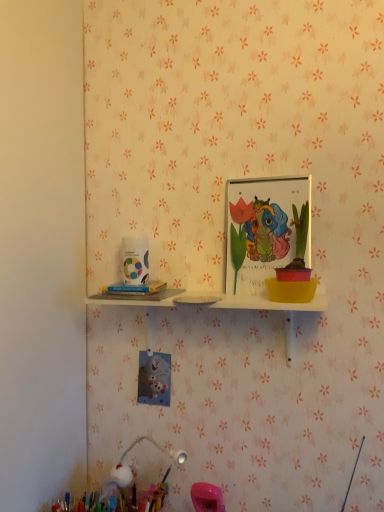
In order to face matte plastic picture frame at upper center, should I rotate leftwards or rightwards?

Rotate right and turn 10.202 degrees.

What do you see at coordinates (265, 230) in the screenshot? The image size is (384, 512). I see `matte plastic picture frame at upper center` at bounding box center [265, 230].

Identify the location of white glossy plate at upper center. Image resolution: width=384 pixels, height=512 pixels. (218, 308).

Describe the element at coordinates (135, 288) in the screenshot. I see `white paper at left` at that location.

Identify the location of pastel fluffy pom-pom at lower left. click(117, 499).

I want to click on matte plastic picture frame at upper center, so click(265, 230).

From the picture: From a real-world perspective, is white glossy plate at upper center physically below white paper at left?

Yes.

The image size is (384, 512). I want to click on shelf lying in front of the white paper at left, so click(218, 308).

Does point (292, 320) appear closer or farther from the camera than point (163, 283)?

Point (292, 320).

Would you say white glossy plate at upper center is to the left or to the right of white paper at left in the picture?

From the image, it's evident that white glossy plate at upper center is to the right of white paper at left.

Is pastel fluffy pom-pom at lower left surrounding white paper at left?

That's incorrect, white paper at left is not inside pastel fluffy pom-pom at lower left.

From the image's perspective, which one is positioned lower, pastel fluffy pom-pom at lower left or white paper at left?

pastel fluffy pom-pom at lower left, from the image's perspective.

Which object is further away from the camera taking this photo, pastel fluffy pom-pom at lower left or white paper at left?

white paper at left is more distant.

In order to click on stationery that appears behind the white glossy plate at upper center in this screenshot , I will do `click(135, 288)`.

Between point (123, 288) and point (201, 306), which one is positioned in front?

Positioned in front is point (123, 288).

Can you tell me how much white paper at left and white glossy plate at upper center differ in facing direction?

9.96 degrees.

Between white paper at left and white glossy plate at upper center, which one is positioned behind?

white paper at left is behind.

From a real-world perspective, relative to matte plastic picture frame at upper center, is pastel fluffy pom-pom at lower left vertically above or below?

pastel fluffy pom-pom at lower left is situated lower than matte plastic picture frame at upper center in the real world.

Is pastel fluffy pom-pom at lower left oriented towards matte plastic picture frame at upper center?

No, pastel fluffy pom-pom at lower left is not facing towards matte plastic picture frame at upper center.

Would you consider pastel fluffy pom-pom at lower left to be distant from matte plastic picture frame at upper center?

No.

Does point (160, 487) come in front of point (284, 234)?

That is False.

Considering the relative positions of white paper at left and pastel fluffy pom-pom at lower left in the image provided, is white paper at left to the left of pastel fluffy pom-pom at lower left from the viewer's perspective?

No.

Is point (166, 284) closer to viewer compared to point (109, 483)?

That is True.

From the image's perspective, is white paper at left below pastel fluffy pom-pom at lower left?

No, from the image's perspective, white paper at left is not beneath pastel fluffy pom-pom at lower left.

Locate an element on the screen. collection directly beneath the white paper at left (from a real-world perspective) is located at coordinates (117, 499).

Is white paper at left bigger or smaller than matte plastic picture frame at upper center?

In the image, white paper at left appears to be smaller than matte plastic picture frame at upper center.

In the scene shown: Which object is positioned more to the left, white paper at left or matte plastic picture frame at upper center?

white paper at left is more to the left.

What's the angular difference between white paper at left and matte plastic picture frame at upper center's facing directions?

There is a 9.96-degree angle between the facing directions of white paper at left and matte plastic picture frame at upper center.

In the scene shown: Is matte plastic picture frame at upper center at the back of white paper at left?

white paper at left does not have its back to matte plastic picture frame at upper center.

What's the angular difference between matte plastic picture frame at upper center and pastel fluffy pom-pom at lower left's facing directions?

The angular difference between matte plastic picture frame at upper center and pastel fluffy pom-pom at lower left is 1.25 degrees.

Can you confirm if matte plastic picture frame at upper center is smaller than pastel fluffy pom-pom at lower left?

Indeed, matte plastic picture frame at upper center has a smaller size compared to pastel fluffy pom-pom at lower left.

Can we say matte plastic picture frame at upper center lies outside pastel fluffy pom-pom at lower left?

Yes, matte plastic picture frame at upper center is not within pastel fluffy pom-pom at lower left.

Is matte plastic picture frame at upper center in front of pastel fluffy pom-pom at lower left?

No, matte plastic picture frame at upper center is further to the viewer.

Where is `stationery on the left of the white glossy plate at upper center`? stationery on the left of the white glossy plate at upper center is located at coordinates (135, 288).

Locate an element on the screen. The height and width of the screenshot is (512, 384). collection that is under the white paper at left (from a real-world perspective) is located at coordinates click(x=117, y=499).

Which object lies further to the anchor point white glossy plate at upper center, white paper at left or matte plastic picture frame at upper center?

matte plastic picture frame at upper center is positioned further to the anchor white glossy plate at upper center.

Considering their positions, is matte plastic picture frame at upper center positioned further to white glossy plate at upper center than white paper at left?

matte plastic picture frame at upper center lies further to white glossy plate at upper center than the other object.

Which object lies further to the anchor point matte plastic picture frame at upper center, pastel fluffy pom-pom at lower left or white glossy plate at upper center?

Based on the image, pastel fluffy pom-pom at lower left appears to be further to matte plastic picture frame at upper center.

Looking at the image, which one is located further to pastel fluffy pom-pom at lower left, white paper at left or matte plastic picture frame at upper center?

matte plastic picture frame at upper center is further to pastel fluffy pom-pom at lower left.

Which object lies further to the anchor point white glossy plate at upper center, white paper at left or pastel fluffy pom-pom at lower left?

The object further to white glossy plate at upper center is pastel fluffy pom-pom at lower left.

Looking at the image, which one is located further to white paper at left, matte plastic picture frame at upper center or pastel fluffy pom-pom at lower left?

The object further to white paper at left is pastel fluffy pom-pom at lower left.

When comparing their distances from pastel fluffy pom-pom at lower left, does white glossy plate at upper center or white paper at left seem further?

white paper at left lies further to pastel fluffy pom-pom at lower left than the other object.

Based on their spatial positions, is matte plastic picture frame at upper center or pastel fluffy pom-pom at lower left further from white glossy plate at upper center?

The object further to white glossy plate at upper center is pastel fluffy pom-pom at lower left.

Locate an element on the screen. Image resolution: width=384 pixels, height=512 pixels. stationery between matte plastic picture frame at upper center and pastel fluffy pom-pom at lower left in the up-down direction is located at coordinates (135, 288).

Where is `shelf between white paper at left and matte plastic picture frame at upper center in the horizontal direction`? The image size is (384, 512). shelf between white paper at left and matte plastic picture frame at upper center in the horizontal direction is located at coordinates (218, 308).

Where is `shelf that lies between matte plastic picture frame at upper center and pastel fluffy pom-pom at lower left from top to bottom`? shelf that lies between matte plastic picture frame at upper center and pastel fluffy pom-pom at lower left from top to bottom is located at coordinates (218, 308).

At what (x,y) coordinates should I click in order to perform the action: click on shelf that lies between white paper at left and pastel fluffy pom-pom at lower left from top to bottom. Please return your answer as a coordinate pair (x, y). This screenshot has height=512, width=384. Looking at the image, I should click on (218, 308).